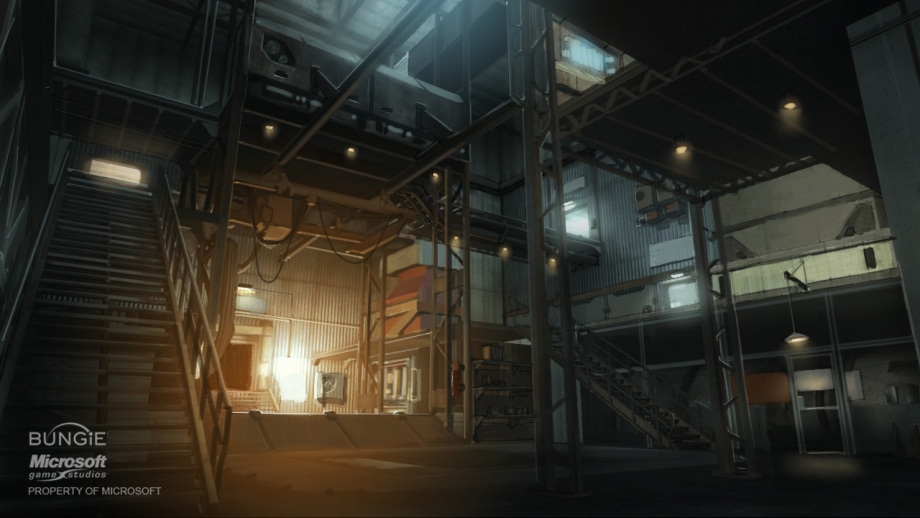
Find the location of a particular element. This screenshot has width=920, height=518. doorway is located at coordinates (833, 407).